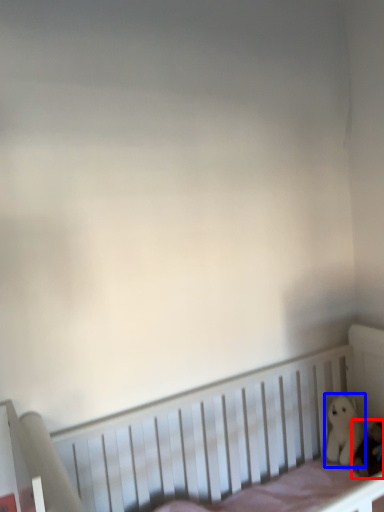
Question: Which object appears closest to the camera in this image, toy (highlighted by a red box) or toy (highlighted by a blue box)?

Choices:
 (A) toy
 (B) toy

Answer: (A)